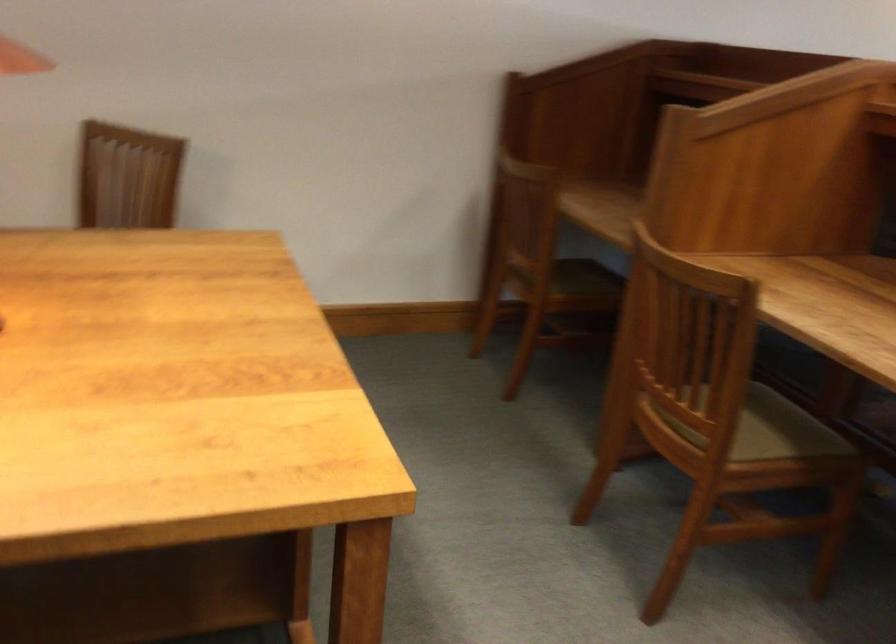
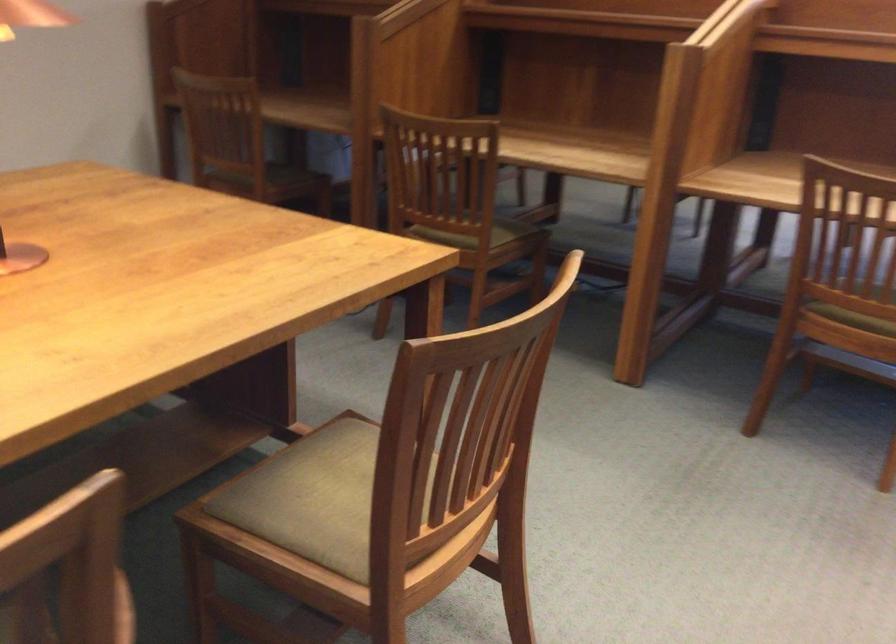
Where in the second image is the point corresponding to the point at 545,294 from the first image?

(264, 182)